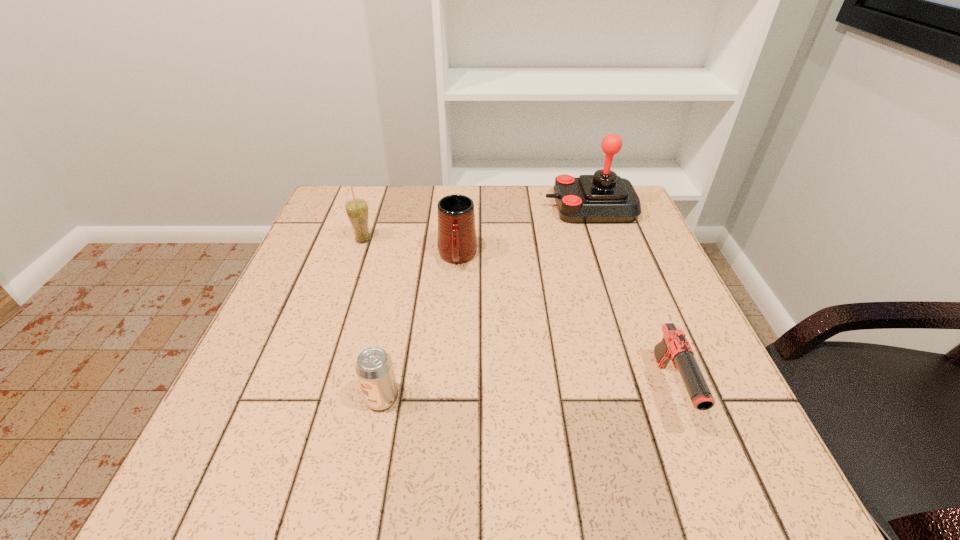
This screenshot has width=960, height=540. Find the location of `free area in between the mug and the second object from left to right`. free area in between the mug and the second object from left to right is located at coordinates (420, 328).

Find the location of a particular element. Image resolution: width=960 pixels, height=540 pixels. vacant space that's between the joystick and the straw for drinking is located at coordinates [x=476, y=224].

Locate an element on the screen. The height and width of the screenshot is (540, 960). free space between the straw for drinking and the beer can is located at coordinates (372, 319).

At what (x,y) coordinates should I click in order to perform the action: click on free space between the third tallest object and the gun. Please return your answer as a coordinate pair (x, y). This screenshot has height=540, width=960. Looking at the image, I should click on (564, 324).

Locate an element on the screen. free area in between the leftmost object and the beer can is located at coordinates (372, 319).

Find the location of a particular element. Image resolution: width=960 pixels, height=540 pixels. empty location between the beer can and the third shortest object is located at coordinates (420, 328).

Locate an element on the screen. object identified as the closest to the beer can is located at coordinates (456, 240).

You are a GUI agent. You are given a task and a screenshot of the screen. Output one action in this format:
    pyautogui.click(x=<x>, y=<y>)
    Task: Click on the object that is the third closest to the third tallest object
    This screenshot has height=540, width=960.
    Given the screenshot: What is the action you would take?
    pyautogui.click(x=374, y=368)

Identify the location of blank space that satisfies the following two spatial constraints: 1. on the base of the tallest object; 2. on the front side of the straw for drinking. (601, 240).

The height and width of the screenshot is (540, 960). Find the location of `vacant area in the image that satisfies the following two spatial constraints: 1. on the base of the farthest object; 2. on the front side of the leftmost object`. vacant area in the image that satisfies the following two spatial constraints: 1. on the base of the farthest object; 2. on the front side of the leftmost object is located at coordinates (601, 240).